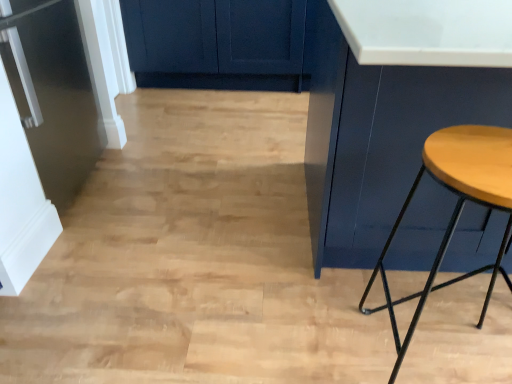
Question: From their relative heights in the image, would you say matte blue cabinet at right is taller or shorter than satin black refrigerator at left?

Choices:
 (A) tall
 (B) short

Answer: (A)

Question: In the image, is matte blue cabinet at right on the left side or the right side of satin black refrigerator at left?

Choices:
 (A) left
 (B) right

Answer: (B)

Question: Which of these objects is positioned farthest from the satin black refrigerator at left?

Choices:
 (A) wooden stool at right
 (B) matte blue cabinet at right

Answer: (A)

Question: Considering the real-world distances, which object is closest to the matte blue cabinet at right?

Choices:
 (A) wooden stool at right
 (B) satin black refrigerator at left

Answer: (A)